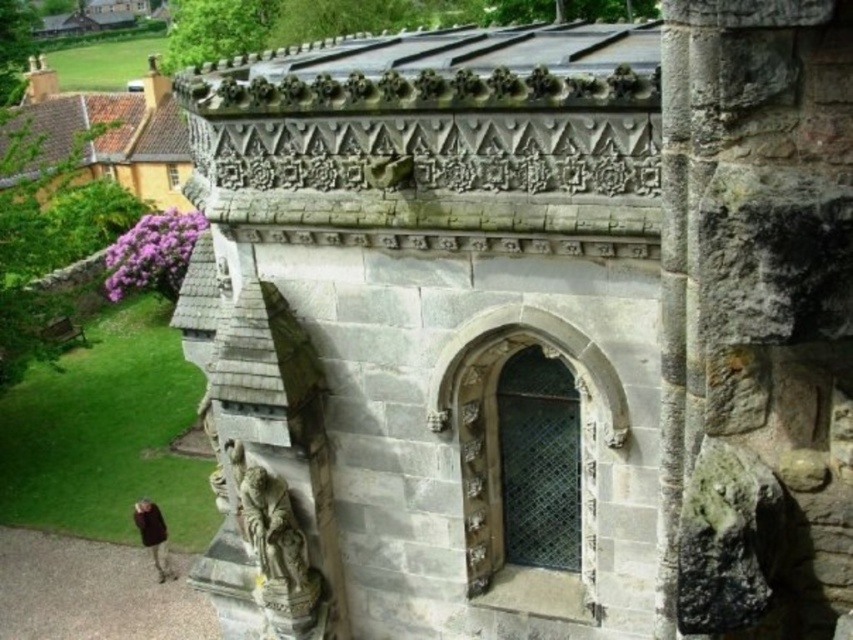
Does gray stone pillar at center have a larger size compared to brown leather jacket at lower left?

Indeed, gray stone pillar at center has a larger size compared to brown leather jacket at lower left.

Where is `gray stone pillar at center`? gray stone pillar at center is located at coordinates (756, 317).

Locate an element on the screen. gray stone pillar at center is located at coordinates click(756, 317).